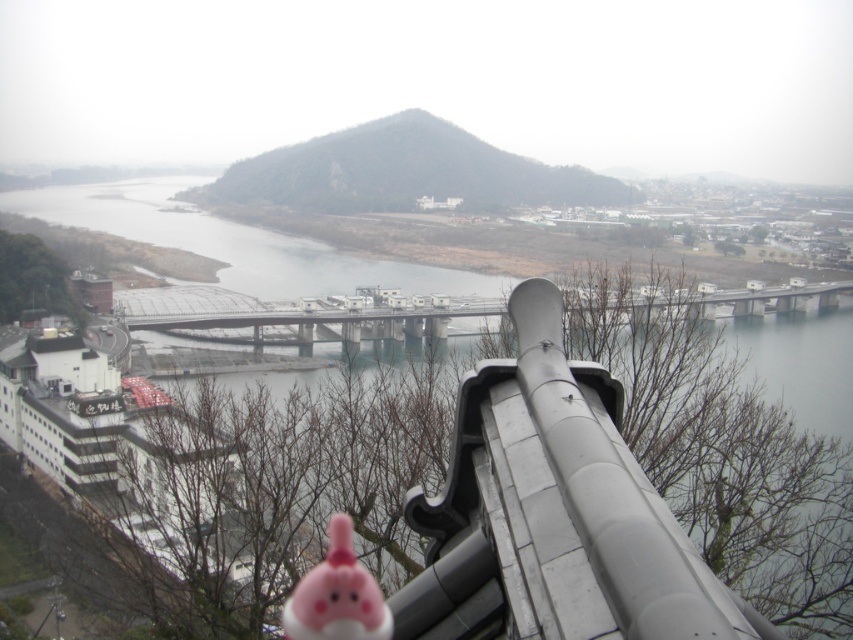
Question: Which of the following is the farthest from the observer?

Choices:
 (A) dark gray rocky peak at center
 (B) matte pink plushie at lower center

Answer: (A)

Question: Does clear water at bridge center appear on the left side of matte pink plushie at lower center?

Choices:
 (A) yes
 (B) no

Answer: (A)

Question: Does dark gray rocky peak at center have a greater width compared to matte pink plushie at lower center?

Choices:
 (A) no
 (B) yes

Answer: (B)

Question: Which is farther from the clear water at bridge center?

Choices:
 (A) matte pink plushie at lower center
 (B) dark gray rocky peak at center

Answer: (A)

Question: Estimate the real-world distances between objects in this image. Which object is farther from the matte pink plushie at lower center?

Choices:
 (A) dark gray rocky peak at center
 (B) clear water at bridge center

Answer: (A)

Question: In this image, where is clear water at bridge center located relative to matte pink plushie at lower center?

Choices:
 (A) below
 (B) above

Answer: (B)